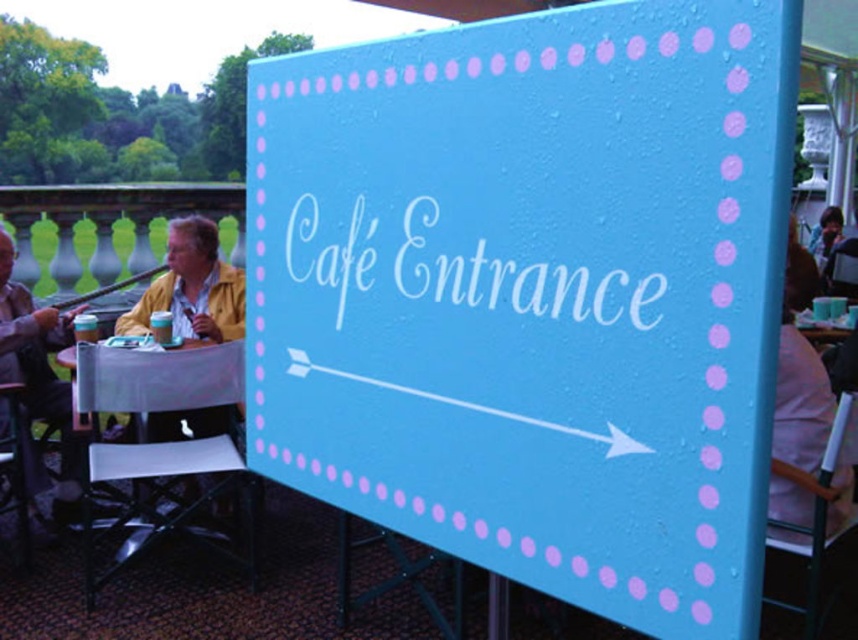
You are a customer looking for the entrance to the outdoor cafe. You see the light blue painted board at center and the matte yellow jacket at left. Which object is taller?

The light blue painted board at center is not as tall as the matte yellow jacket at left, so the matte yellow jacket at left is taller.

You are standing at the point labeled point [158,403] and want to walk towards the point labeled point [677,621]. Given that the distance between these two points is 1.2 meters, will you walk forward or backward to reach your destination?

Since point [677,621] is closer to the camera than point [158,403], you would need to walk backward to reach point [677,621] from point [158,403].

You are a delivery person trying to navigate to the entrance of the outdoor cafe. You see the light blue painted board at center and the matte yellow jacket at left. Which object is wider from your perspective?

The light blue painted board at center might be wider than matte yellow jacket at left according to the description.